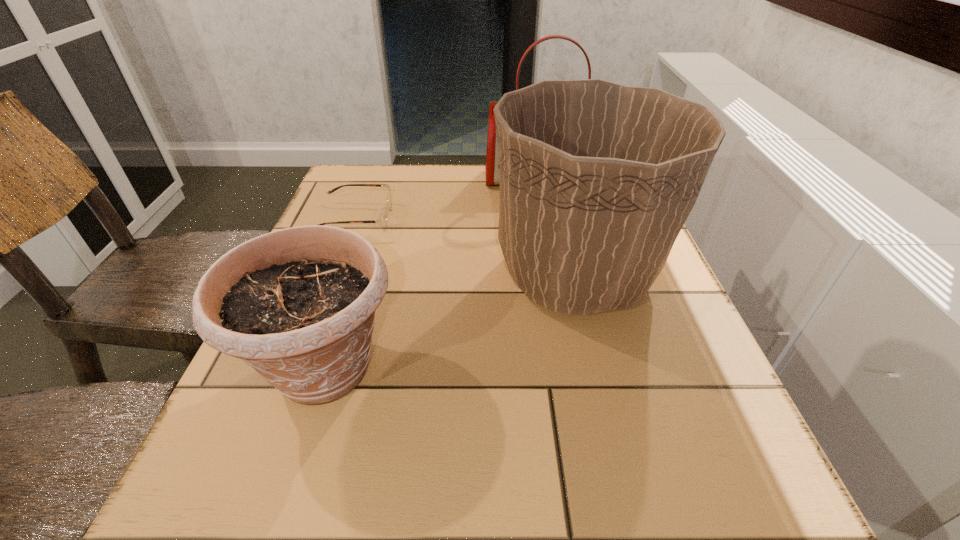
This screenshot has height=540, width=960. Find the location of `spectacles present at the far edge`. spectacles present at the far edge is located at coordinates (382, 220).

The height and width of the screenshot is (540, 960). I want to click on flowerpot situated at the left edge, so click(x=298, y=305).

Image resolution: width=960 pixels, height=540 pixels. I want to click on spectacles that is at the left edge, so click(382, 220).

This screenshot has height=540, width=960. I want to click on handbag located in the right edge section of the desktop, so click(492, 167).

Locate an element on the screen. The width and height of the screenshot is (960, 540). flowerpot positioned at the right edge is located at coordinates (597, 179).

What are the coordinates of `object present at the far left corner` in the screenshot? It's located at (382, 220).

I want to click on object that is at the far right corner, so click(x=492, y=167).

Locate an element on the screen. The width and height of the screenshot is (960, 540). free space at the far edge of the desktop is located at coordinates (436, 182).

At what (x,y) coordinates should I click in order to perform the action: click on vacant space at the near edge. Please return your answer as a coordinate pair (x, y). The height and width of the screenshot is (540, 960). Looking at the image, I should click on (547, 529).

In the image, there is a desktop. Identify the location of vacant space at the left edge. The image size is (960, 540). coord(255,408).